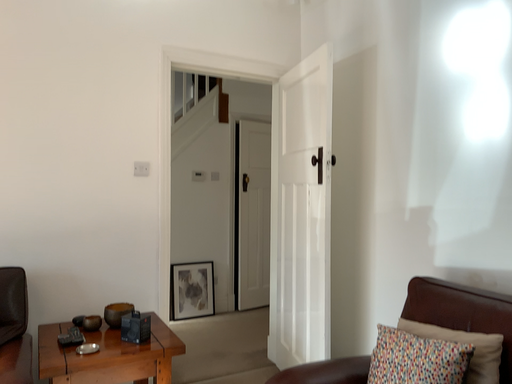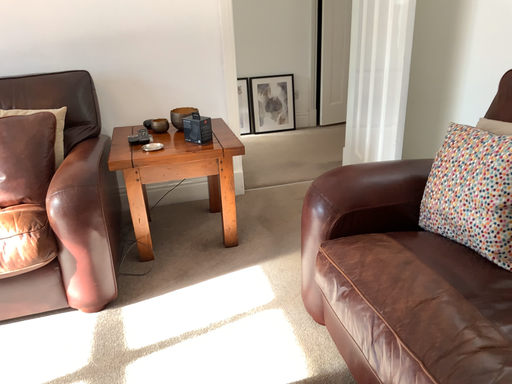
Question: How did the camera likely rotate when shooting the video?

Choices:
 (A) rotated right
 (B) rotated left

Answer: (B)